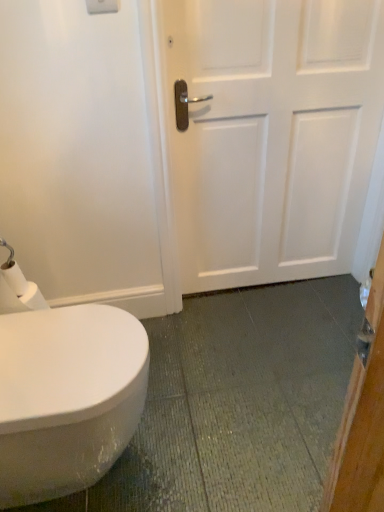
Where is `white glossy bidet at lower left`? Image resolution: width=384 pixels, height=512 pixels. white glossy bidet at lower left is located at coordinates (67, 398).

Identify the location of white matte door at center. pos(271,134).

Would you consider white matte door at center to be distant from white glossy bidet at lower left?

white matte door at center is actually quite close to white glossy bidet at lower left.

Find the location of a particular element. bidet below the white matte door at center (from the image's perspective) is located at coordinates (67, 398).

How different are the orientations of white matte door at center and white glossy bidet at lower left in degrees?

They differ by 90.6 degrees in their facing directions.

From the image's perspective, is white matte toilet paper at lower left under white matte door at center?

Yes.

Between white matte toilet paper at lower left and white matte door at center, which one has larger width?

Wider between the two is white matte door at center.

The width and height of the screenshot is (384, 512). Identify the location of door above the white matte toilet paper at lower left (from a real-world perspective). (271, 134).

Is white matte toilet paper at lower left bigger than white matte door at center?

Actually, white matte toilet paper at lower left might be smaller than white matte door at center.

From a real-world perspective, between white glossy bidet at lower left and white matte toilet paper at lower left, who is vertically higher?

white matte toilet paper at lower left, from a real-world perspective.

Considering the positions of objects white glossy bidet at lower left and white matte toilet paper at lower left in the image provided, who is behind, white glossy bidet at lower left or white matte toilet paper at lower left?

Positioned behind is white matte toilet paper at lower left.

From the picture: Is white glossy bidet at lower left positioned with its back to white matte toilet paper at lower left?

No, white matte toilet paper at lower left is not at the back of white glossy bidet at lower left.

Looking at this image, considering the sizes of objects white glossy bidet at lower left and white matte toilet paper at lower left in the image provided, who is smaller, white glossy bidet at lower left or white matte toilet paper at lower left?

white matte toilet paper at lower left is smaller.

This screenshot has width=384, height=512. Find the location of `toilet paper below the white matte door at center (from a real-world perspective)`. toilet paper below the white matte door at center (from a real-world perspective) is located at coordinates (18, 291).

Can you confirm if white matte door at center is smaller than white matte toilet paper at lower left?

Incorrect, white matte door at center is not smaller in size than white matte toilet paper at lower left.

Is white matte door at center in contact with white matte toilet paper at lower left?

There is a gap between white matte door at center and white matte toilet paper at lower left.

Is point (195, 57) farther from viewer compared to point (13, 310)?

Yes, it is.

From the picture: Is there a large distance between white glossy bidet at lower left and white matte door at center?

No, white glossy bidet at lower left is not far away from white matte door at center.

Considering the positions of points (28, 504) and (307, 75), is point (28, 504) farther from camera compared to point (307, 75)?

No, it is in front of (307, 75).

Looking at this image, considering the positions of objects white glossy bidet at lower left and white matte door at center in the image provided, who is more to the right, white glossy bidet at lower left or white matte door at center?

Positioned to the right is white matte door at center.

Is white matte door at center completely or partially inside white glossy bidet at lower left?

No, white matte door at center is not a part of white glossy bidet at lower left.

Considering the sizes of objects white matte toilet paper at lower left and white glossy bidet at lower left in the image provided, who is shorter, white matte toilet paper at lower left or white glossy bidet at lower left?

With less height is white matte toilet paper at lower left.

Is white matte toilet paper at lower left facing towards white glossy bidet at lower left?

Yes, white matte toilet paper at lower left is turned towards white glossy bidet at lower left.

Would you say white matte toilet paper at lower left is inside or outside white glossy bidet at lower left?

white matte toilet paper at lower left is spatially situated outside white glossy bidet at lower left.

From the image's perspective, which is below, white matte toilet paper at lower left or white glossy bidet at lower left?

white glossy bidet at lower left appears lower in the image.

The width and height of the screenshot is (384, 512). In order to click on door behind the white glossy bidet at lower left in this screenshot , I will do `click(271, 134)`.

You are a GUI agent. You are given a task and a screenshot of the screen. Output one action in this format:
    pyautogui.click(x=<x>, y=<y>)
    Task: Click on the door lying on the right of white matte toilet paper at lower left
    This screenshot has width=384, height=512.
    Given the screenshot: What is the action you would take?
    pyautogui.click(x=271, y=134)

Based on their spatial positions, is white matte door at center or white matte toilet paper at lower left further from white glossy bidet at lower left?

white matte door at center lies further to white glossy bidet at lower left than the other object.

Estimate the real-world distances between objects in this image. Which object is closer to white matte door at center, white glossy bidet at lower left or white matte toilet paper at lower left?

white glossy bidet at lower left is positioned closer to the anchor white matte door at center.

Based on their spatial positions, is white glossy bidet at lower left or white matte door at center closer to white matte toilet paper at lower left?

The object closer to white matte toilet paper at lower left is white glossy bidet at lower left.

Which object lies nearer to the anchor point white matte door at center, white matte toilet paper at lower left or white glossy bidet at lower left?

white glossy bidet at lower left is positioned closer to the anchor white matte door at center.

Based on their spatial positions, is white matte door at center or white glossy bidet at lower left further from white matte toilet paper at lower left?

Based on the image, white matte door at center appears to be further to white matte toilet paper at lower left.

Estimate the real-world distances between objects in this image. Which object is further from white glossy bidet at lower left, white matte toilet paper at lower left or white matte door at center?

white matte door at center.

Where is `bidet between white matte toilet paper at lower left and white matte door at center`? bidet between white matte toilet paper at lower left and white matte door at center is located at coordinates (67, 398).